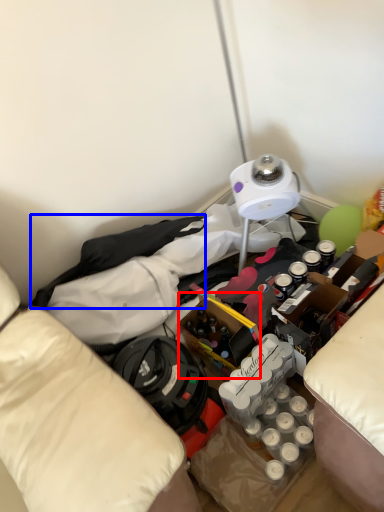
Question: Which object is closer to the camera taking this photo, wine bottle (highlighted by a red box) or clothing (highlighted by a blue box)?

Choices:
 (A) wine bottle
 (B) clothing

Answer: (A)